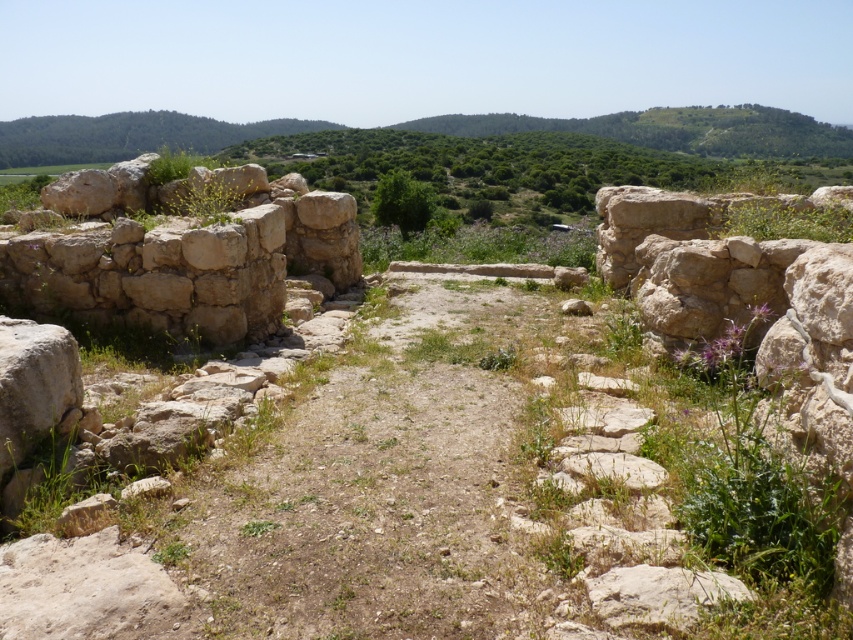
Question: Can you confirm if dirt path at center is wider than beige rough stone wall at left?

Choices:
 (A) no
 (B) yes

Answer: (A)

Question: Which object is farther from the camera taking this photo?

Choices:
 (A) beige rough stone wall at left
 (B) dirt path at center

Answer: (A)

Question: Which object appears farthest from the camera in this image?

Choices:
 (A) dirt path at center
 (B) beige rough stone wall at left

Answer: (B)

Question: Can you confirm if dirt path at center is positioned to the left of beige rough stone wall at left?

Choices:
 (A) yes
 (B) no

Answer: (B)

Question: Is dirt path at center further to camera compared to beige rough stone wall at left?

Choices:
 (A) yes
 (B) no

Answer: (B)